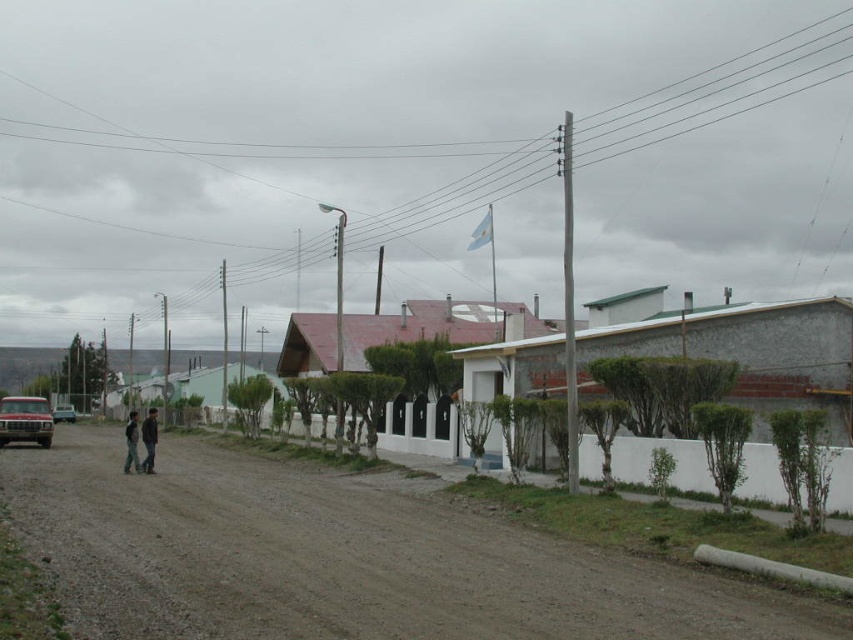
Is point (152, 440) positioned before point (64, 408)?

Yes, point (152, 440) is in front of point (64, 408).

Does point (154, 440) come farther from viewer compared to point (61, 413)?

No, it is in front of (61, 413).

Where is `dark gray jacket at center`? This screenshot has width=853, height=640. dark gray jacket at center is located at coordinates (149, 440).

Does white stucco houses at center have a larger size compared to matte silver truck at left?

Yes.

Which of these two, white stucco houses at center or matte silver truck at left, stands taller?

white stucco houses at center

Where is `white stucco houses at center`? Image resolution: width=853 pixels, height=640 pixels. white stucco houses at center is located at coordinates (749, 362).

Can you confirm if brown dirt track at center is taller than dark gray jacket at center?

In fact, brown dirt track at center may be shorter than dark gray jacket at center.

Which is behind, point (373, 540) or point (148, 417)?

Point (148, 417)

Where is `brown dirt track at center`? The width and height of the screenshot is (853, 640). brown dirt track at center is located at coordinates (343, 557).